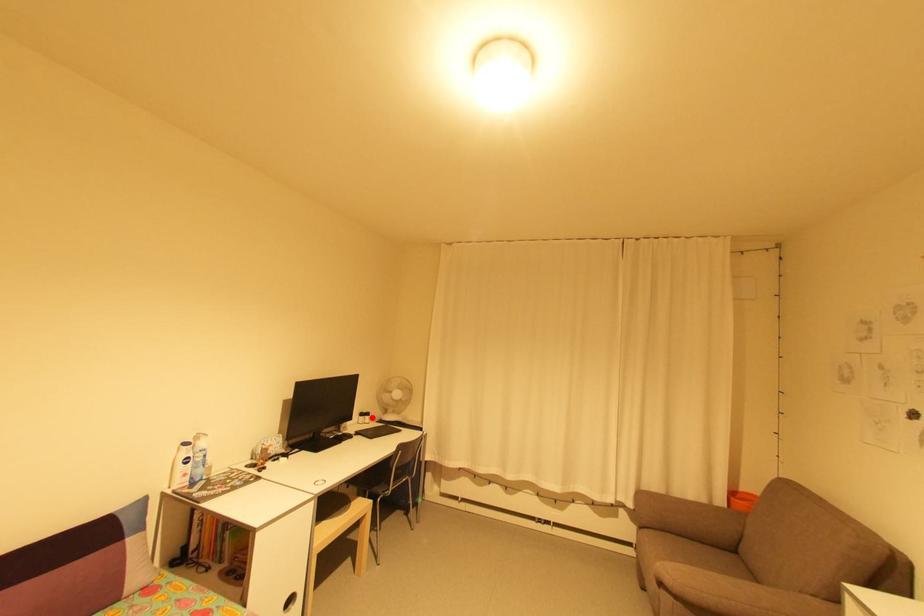
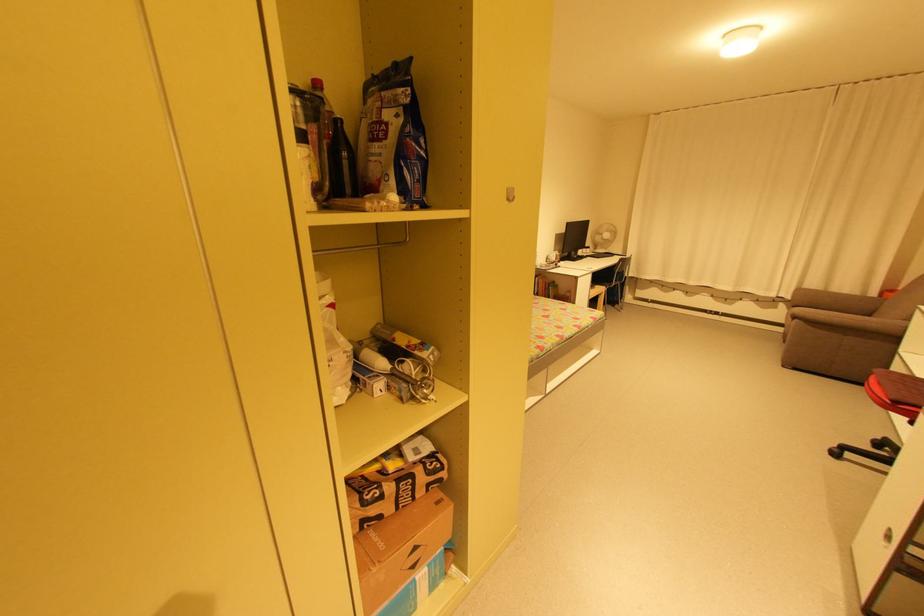
Find the pixel in the second image that matches the highlighted location in the first image.

(592, 249)